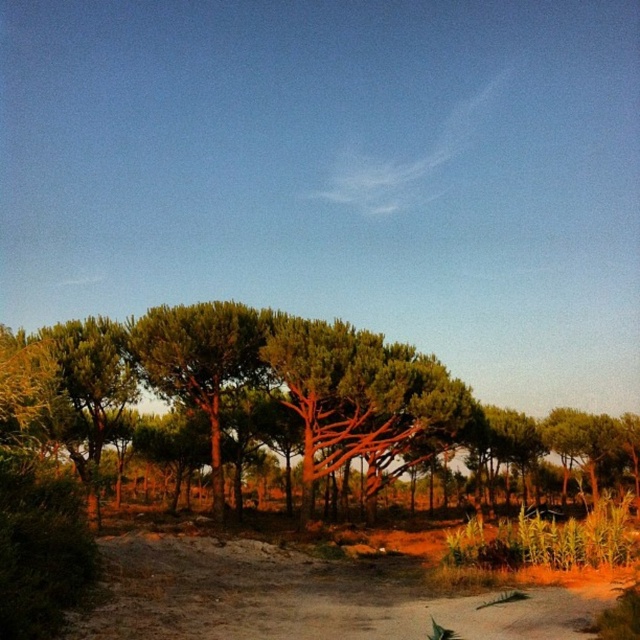
Question: Does green leafy tree at left have a lesser width compared to brown sandy dirt track at lower center?

Choices:
 (A) yes
 (B) no

Answer: (B)

Question: Among these points, which one is farthest from the camera?

Choices:
 (A) (212, 636)
 (B) (378, 372)

Answer: (B)

Question: Considering the relative positions of green leafy tree at left and brown sandy dirt track at lower center in the image provided, where is green leafy tree at left located with respect to brown sandy dirt track at lower center?

Choices:
 (A) above
 (B) below

Answer: (B)

Question: Which of the following is the farthest from the observer?

Choices:
 (A) (168, 369)
 (B) (298, 609)

Answer: (A)

Question: Is green leafy tree at left below brown sandy dirt track at lower center?

Choices:
 (A) no
 (B) yes

Answer: (B)

Question: Which of the following is the farthest from the observer?

Choices:
 (A) (346, 349)
 (B) (212, 538)

Answer: (A)